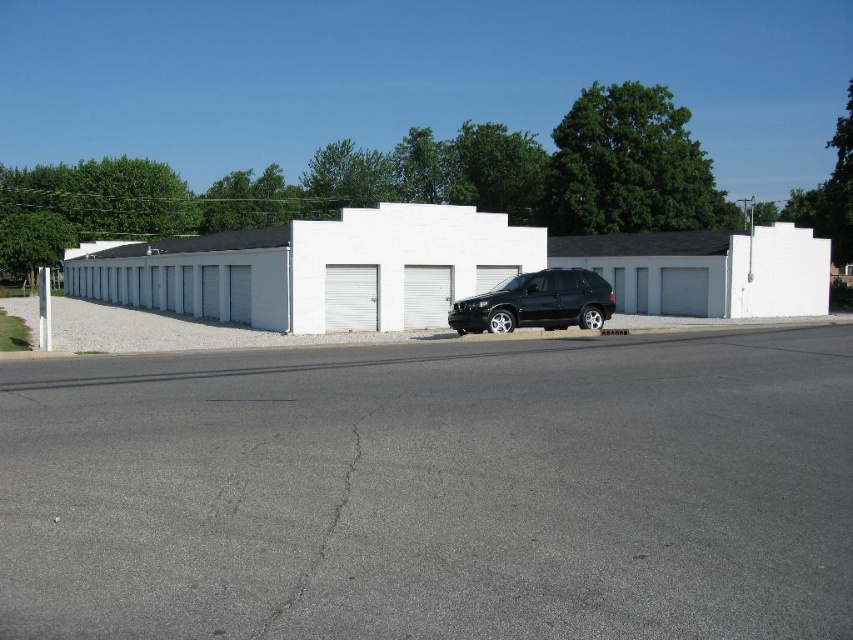
Looking at this image, you are a delivery person needing to park your truck between the white metallic garage door at center and the gray metallic garage door at center. The truck requires 15 meters of space. Can you fit the truck between them?

The distance between the white metallic garage door at center and the gray metallic garage door at center is 18.00 meters, which is sufficient to accommodate the truck requiring 15 meters of space.

You are driving a delivery van that is 12 feet long and need to park between the black matte suv at center and the white rolling door at center. Can your van fit in the space between them without overlapping either vehicle?

The distance between the black matte suv at center and the white rolling door at center is 7.68 feet. Since the van is 12 feet long, it cannot fit in the space between them without overlapping either vehicle.

You are a delivery person trying to unload a package for the white metallic garage door at center and the gray metallic garage door at center. Which garage door should you deliver to first if you want to start from the lower part of the storage units?

You should deliver to the white metallic garage door at center first because it is located below the gray metallic garage door at center, so it is lower and closer to your starting position.